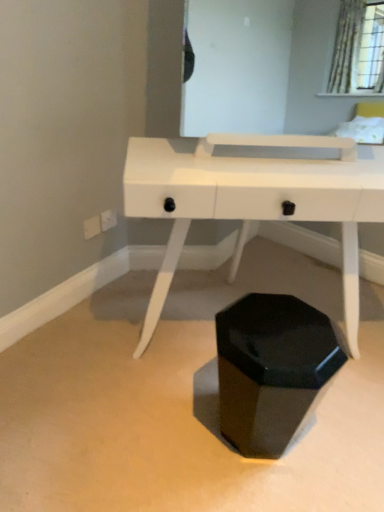
Question: Is point (238, 202) closer or farther from the camera than point (264, 297)?

Choices:
 (A) farther
 (B) closer

Answer: (B)

Question: In the image, is white glossy desk at center on the left side or the right side of black glossy hexagonal at center?

Choices:
 (A) left
 (B) right

Answer: (B)

Question: From the image's perspective, is white glossy desk at center located above or below black glossy hexagonal at center?

Choices:
 (A) below
 (B) above

Answer: (B)

Question: From the image's perspective, is black glossy hexagonal at center above or below white glossy desk at center?

Choices:
 (A) below
 (B) above

Answer: (A)

Question: Based on their positions, is black glossy hexagonal at center located to the left or right of white glossy desk at center?

Choices:
 (A) right
 (B) left

Answer: (B)

Question: Considering the positions of point (253, 300) and point (223, 181), is point (253, 300) closer or farther from the camera than point (223, 181)?

Choices:
 (A) closer
 (B) farther

Answer: (B)

Question: Is black glossy hexagonal at center inside or outside of white glossy desk at center?

Choices:
 (A) outside
 (B) inside

Answer: (A)